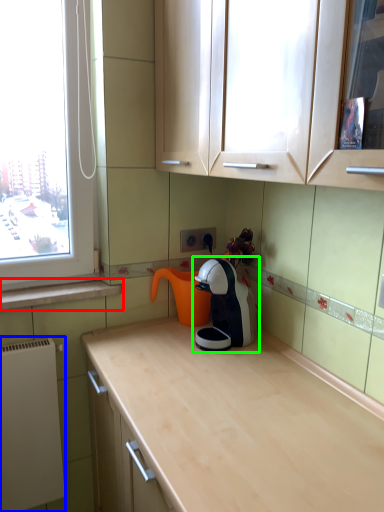
Question: Which object is positioned farthest from window sill (highlighted by a red box)? Select from appliance (highlighted by a blue box) and home appliance (highlighted by a green box).

Choices:
 (A) appliance
 (B) home appliance

Answer: (B)